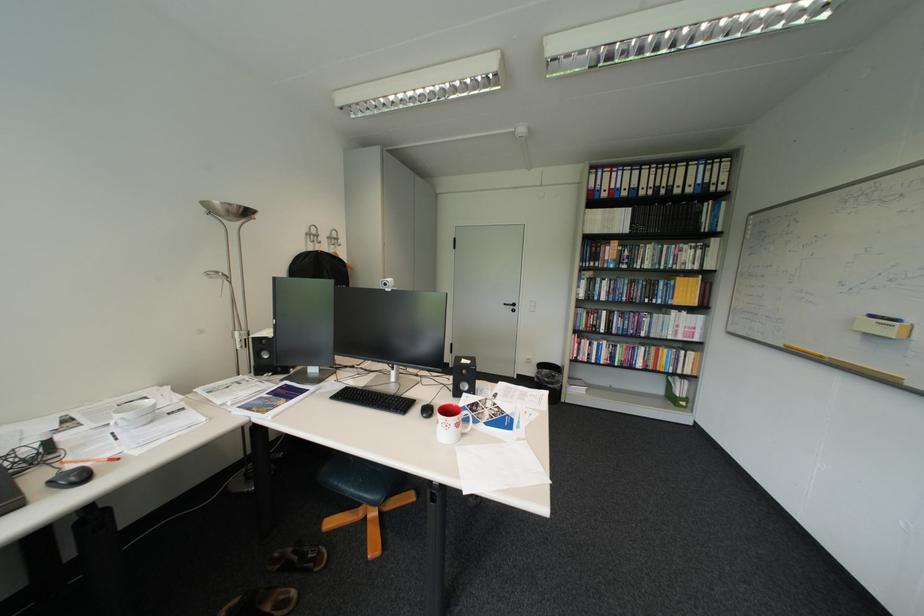
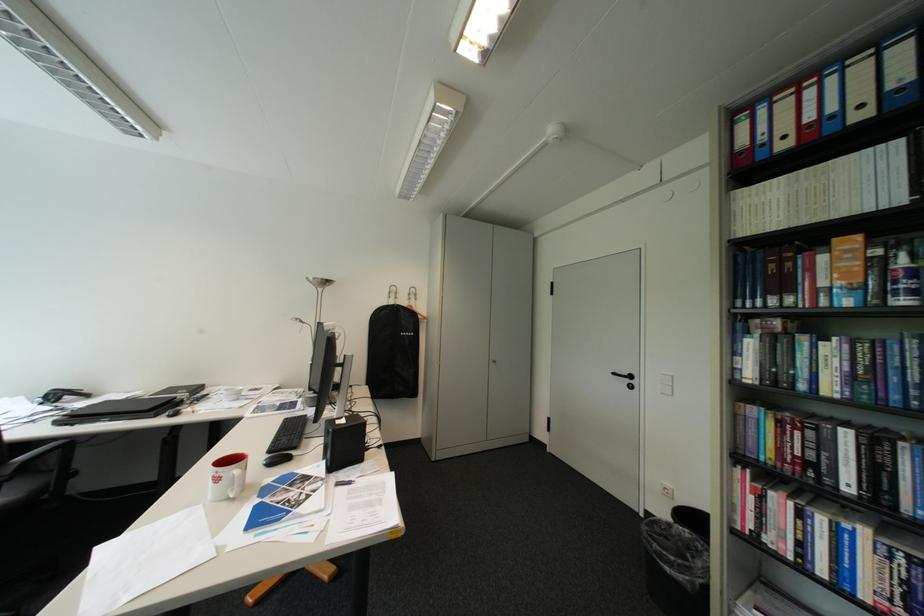
The point at (517, 305) is marked in the first image. Where is the corresponding point in the second image?

(626, 374)